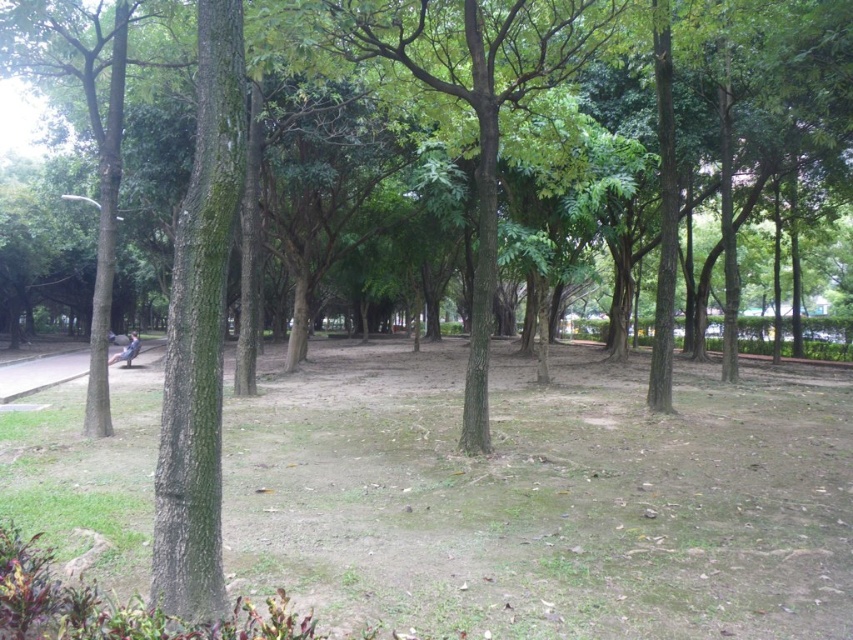
Question: Does green grass at center appear on the right side of brown rough tree at left?

Choices:
 (A) no
 (B) yes

Answer: (B)

Question: Does green grass at center lie behind smooth concrete path at lower left?

Choices:
 (A) yes
 (B) no

Answer: (B)

Question: Among these points, which one is nearest to the camera?

Choices:
 (A) (268, 456)
 (B) (476, 90)
 (C) (53, 356)

Answer: (B)

Question: Does green leafy tree at center have a lesser width compared to brown rough tree at left?

Choices:
 (A) no
 (B) yes

Answer: (B)

Question: Which point appears closest to the camera in this image?

Choices:
 (A) (57, 365)
 (B) (51, 525)
 (C) (91, 337)
 (D) (291, 12)

Answer: (B)

Question: Based on their relative distances, which object is nearer to the smooth concrete path at lower left?

Choices:
 (A) brown rough tree at left
 (B) green leafy tree at center

Answer: (A)